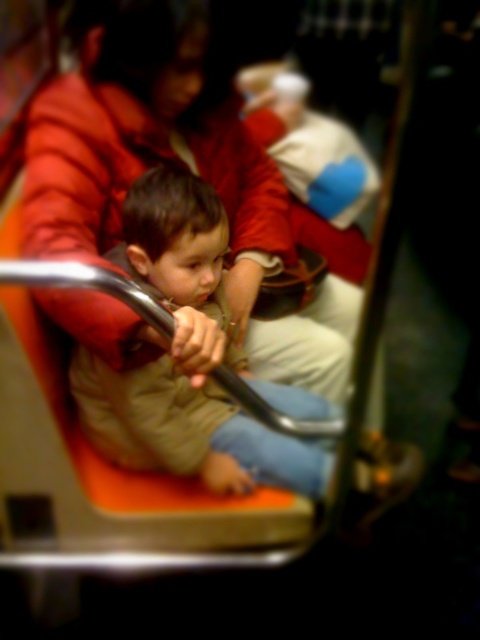
Question: Which point is closer to the camera taking this photo?

Choices:
 (A) (240, 328)
 (B) (153, 266)

Answer: (B)

Question: Does matte red jacket at upper left lie behind khaki fabric jacket at center?

Choices:
 (A) no
 (B) yes

Answer: (A)

Question: Which object is closer to the camera taking this photo?

Choices:
 (A) matte red jacket at upper left
 (B) khaki fabric jacket at center

Answer: (A)

Question: Which of the following is the farthest from the observer?

Choices:
 (A) (214, 182)
 (B) (168, 278)

Answer: (A)

Question: Is matte red jacket at upper left to the left of khaki fabric jacket at center from the viewer's perspective?

Choices:
 (A) no
 (B) yes

Answer: (A)

Question: Does matte red jacket at upper left have a larger size compared to khaki fabric jacket at center?

Choices:
 (A) yes
 (B) no

Answer: (A)